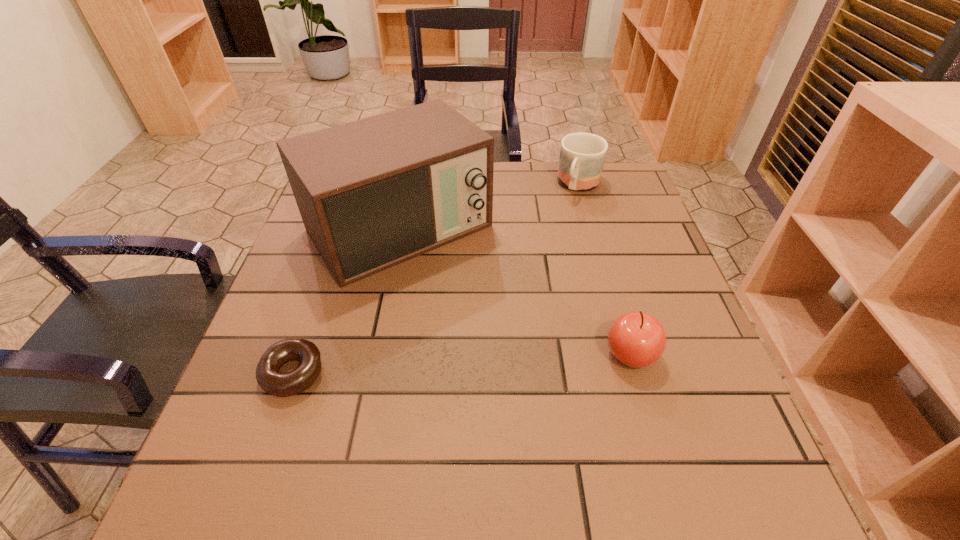
You are a GUI agent. You are given a task and a screenshot of the screen. Output one action in this format:
    pyautogui.click(x=<x>, y=<y>)
    Task: Click on the object at the near left corner
    This screenshot has height=540, width=960.
    Given the screenshot: What is the action you would take?
    pyautogui.click(x=276, y=383)

At what (x,y) coordinates should I click in order to perform the action: click on object at the far right corner. Please return your answer as a coordinate pair (x, y). Image resolution: width=960 pixels, height=540 pixels. Looking at the image, I should click on (582, 155).

The height and width of the screenshot is (540, 960). What are the coordinates of `vacant space at the far edge of the desktop` in the screenshot? It's located at (537, 183).

The image size is (960, 540). What are the coordinates of `free spot at the near edge of the desktop` in the screenshot? It's located at (393, 414).

Image resolution: width=960 pixels, height=540 pixels. In the image, there is a desktop. In order to click on vacant space at the left edge in this screenshot , I will do `click(327, 306)`.

You are a GUI agent. You are given a task and a screenshot of the screen. Output one action in this format:
    pyautogui.click(x=<x>, y=<y>)
    Task: Click on the vacant position at the right edge of the desktop
    The width and height of the screenshot is (960, 540).
    Given the screenshot: What is the action you would take?
    pyautogui.click(x=592, y=216)

Find the location of a particular element. This screenshot has width=960, height=540. free space at the near left corner is located at coordinates tap(267, 441).

I want to click on free space at the near right corner of the desktop, so click(x=687, y=440).

The image size is (960, 540). Find the location of `vacant point located between the shortest object and the apple`. vacant point located between the shortest object and the apple is located at coordinates (463, 363).

The height and width of the screenshot is (540, 960). I want to click on free space between the apple and the mug, so click(605, 269).